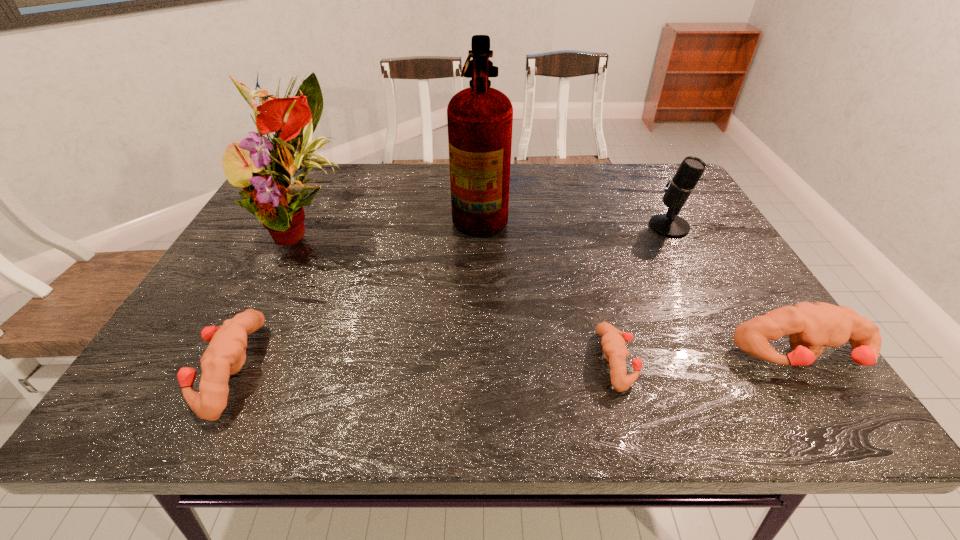
This screenshot has width=960, height=540. Identify the location of unoccupied position between the leftmost puncher and the fire extinguisher. (355, 289).

What are the coordinates of `object that is the second closest one to the bouquet` in the screenshot? It's located at (480, 118).

Point out which object is positioned as the nearest to the microphone. Please provide its 2D coordinates. Your answer should be formatted as a tuple, i.e. [(x, y)], where the tuple contains the x and y coordinates of a point satisfying the conditions above.

[(811, 327)]

Locate an element on the screen. Image resolution: width=960 pixels, height=540 pixels. the closest puncher to the rightmost puncher is located at coordinates (613, 340).

The image size is (960, 540). Identify the location of puncher that is the second closest to the bouquet. (613, 340).

The height and width of the screenshot is (540, 960). I want to click on vacant area that satisfies the following two spatial constraints: 1. at the nozzle of the tallest object; 2. on the right side of the third tallest object, so click(480, 226).

This screenshot has height=540, width=960. I want to click on vacant point that satisfies the following two spatial constraints: 1. at the nozzle of the microphone; 2. on the left side of the third object from left to right, so click(480, 226).

You are a GUI agent. You are given a task and a screenshot of the screen. Output one action in this format:
    pyautogui.click(x=<x>, y=<y>)
    Task: Click on the free space that satisfies the following two spatial constraints: 1. on the back side of the fourth shortest object; 2. at the nozzle of the fourth object from right to left
    The image size is (960, 540).
    Given the screenshot: What is the action you would take?
    pyautogui.click(x=660, y=210)

Find the location of a particular element. This screenshot has height=540, width=960. vacant space that satisfies the following two spatial constraints: 1. on the front-facing side of the bouquet; 2. with the gloves of the second tallest puncher facing forward is located at coordinates (235, 369).

Locate an element on the screen. The image size is (960, 540). vacant position in the image that satisfies the following two spatial constraints: 1. on the front side of the microphone; 2. with the gloves of the third object from right to left facing forward is located at coordinates (742, 361).